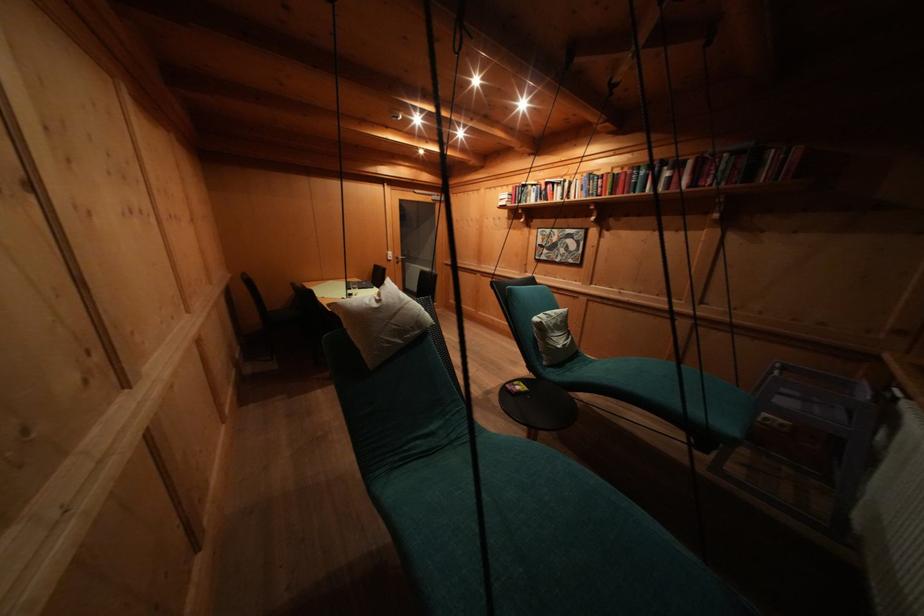
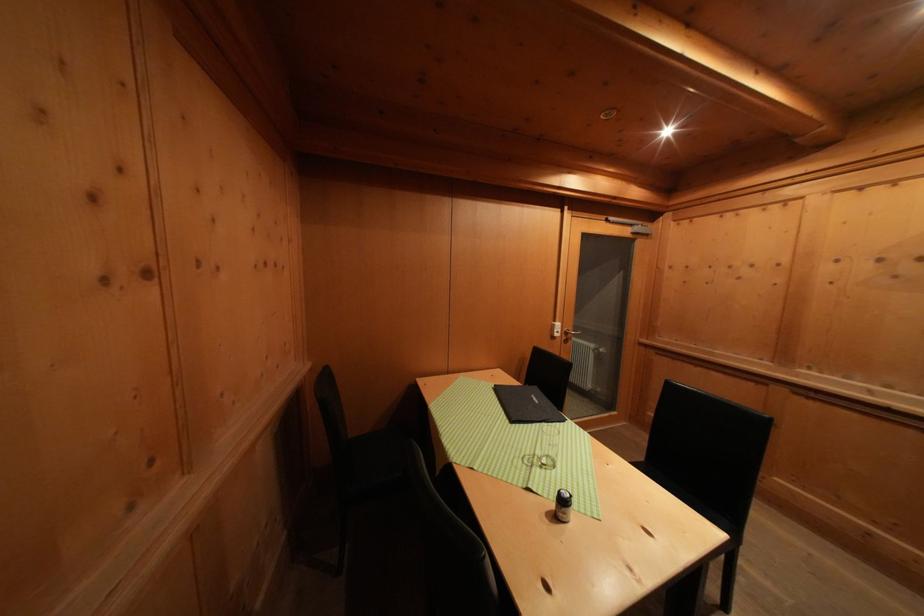
Where in the second image is the point corresponding to point (396, 257) from the first image?

(564, 330)